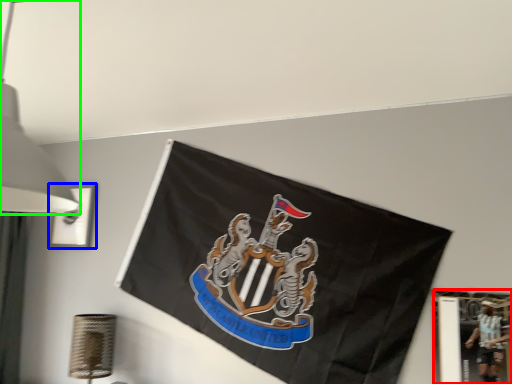
Question: Estimate the real-world distances between objects in this image. Which object is farther from picture frame (highlighted by a red box), picture frame (highlighted by a blue box) or lamp (highlighted by a green box)?

Choices:
 (A) picture frame
 (B) lamp

Answer: (A)